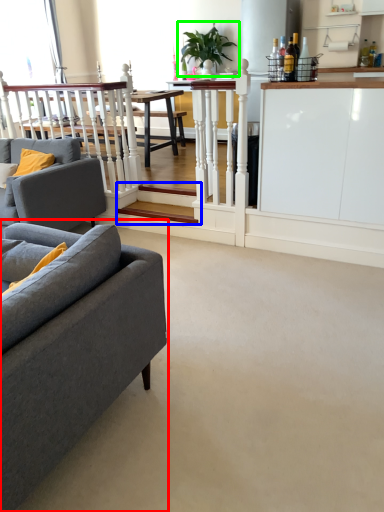
Question: Which is farther away from studio couch (highlighted by a red box)? stairwell (highlighted by a blue box) or houseplant (highlighted by a green box)?

Choices:
 (A) stairwell
 (B) houseplant

Answer: (B)